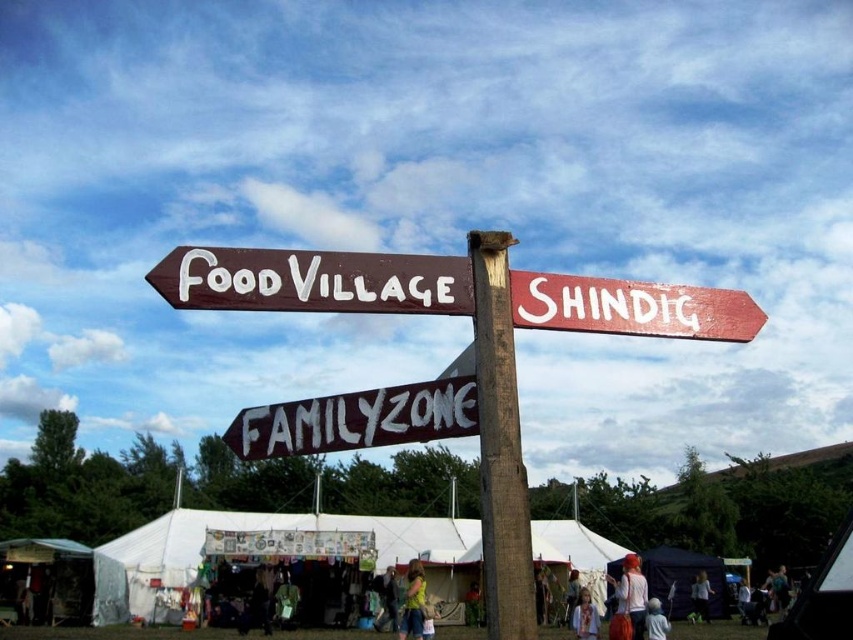
Does white canvas tent at lower center lie in front of white painted wood sign at center?

That is True.

Who is more distant from viewer, (129,564) or (323,412)?

Point (129,564)

Where is `white canvas tent at lower center`? The height and width of the screenshot is (640, 853). white canvas tent at lower center is located at coordinates [x=252, y=531].

Identify the location of white canvas tent at lower center. The height and width of the screenshot is (640, 853). (252, 531).

Between brown wooden signpost at center and wooden signpost at upper right, which one has more height?

With more height is brown wooden signpost at center.

Which is more to the left, brown wooden signpost at center or wooden signpost at upper right?

brown wooden signpost at center is more to the left.

The image size is (853, 640). I want to click on brown wooden signpost at center, so click(x=314, y=282).

Which is behind, point (405, 614) or point (666, 620)?

Point (666, 620)

Does yellow shirt at center appear on the right side of white cotton shirt at lower center?

In fact, yellow shirt at center is to the left of white cotton shirt at lower center.

In order to click on yellow shirt at center in this screenshot , I will do `click(413, 602)`.